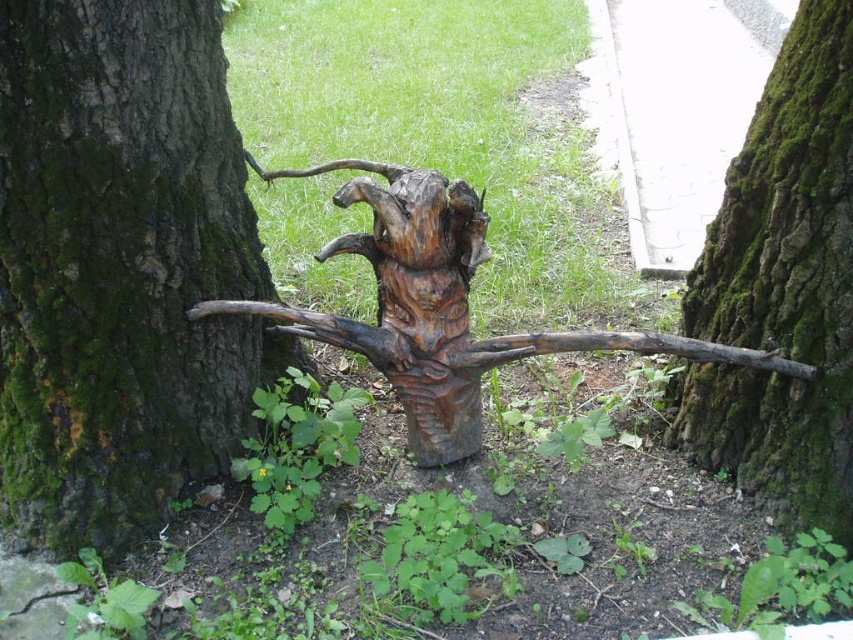
Is point (25, 109) closer to camera compared to point (809, 196)?

Yes, point (25, 109) is in front of point (809, 196).

Does dark brown wood at center appear on the right side of green mossy bark at center?

In fact, dark brown wood at center is to the left of green mossy bark at center.

Is point (207, 68) closer to camera compared to point (786, 413)?

Yes, point (207, 68) is closer to viewer.

I want to click on dark brown wood at center, so click(120, 266).

Between green mossy bark at center and natural wood sculpture at center, which one appears on the left side from the viewer's perspective?

Positioned to the left is natural wood sculpture at center.

Based on the photo, can you confirm if green mossy bark at center is positioned above natural wood sculpture at center?

Yes, green mossy bark at center is above natural wood sculpture at center.

Measure the distance between point (820, 358) and camera.

They are 5.14 feet apart.

The width and height of the screenshot is (853, 640). I want to click on green mossy bark at center, so click(x=782, y=289).

Who is taller, dark brown wood at center or natural wood sculpture at center?

Standing taller between the two is dark brown wood at center.

Between dark brown wood at center and natural wood sculpture at center, which one is positioned higher?

dark brown wood at center

Between point (71, 531) and point (390, 328), which one is positioned behind?

Point (390, 328)

Where is `dark brown wood at center`? dark brown wood at center is located at coordinates (120, 266).